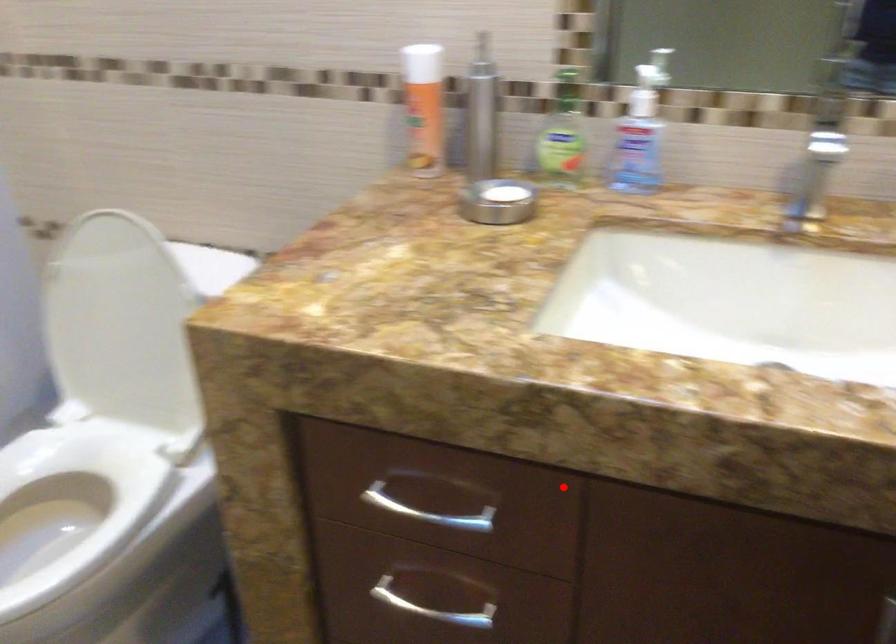
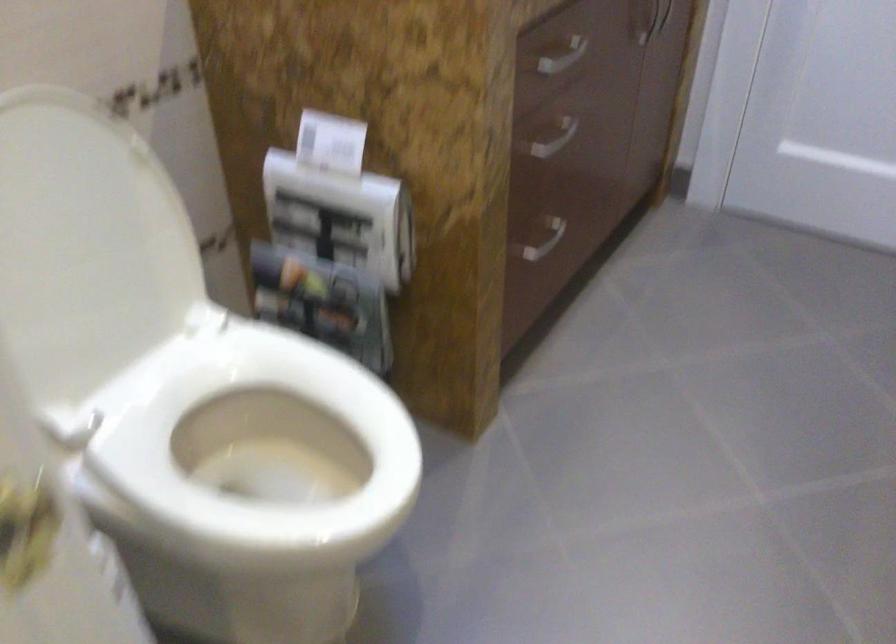
In the second image, find the point that corresponds to the highlighted location in the first image.

(562, 57)